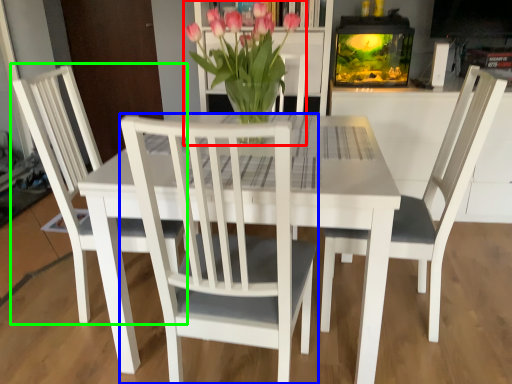
Question: Estimate the real-world distances between objects in this image. Which object is farther from houseplant (highlighted by a red box), chair (highlighted by a blue box) or chair (highlighted by a green box)?

Choices:
 (A) chair
 (B) chair

Answer: (B)